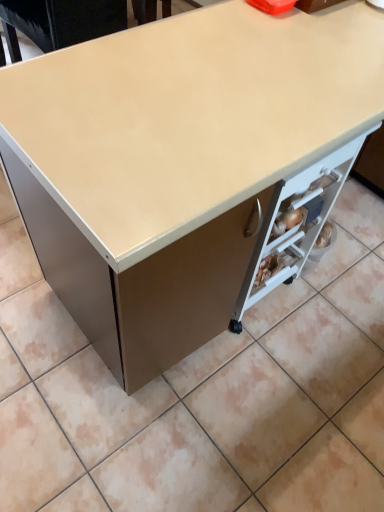
Where is `matte white drawer at lower right`? This screenshot has width=384, height=512. matte white drawer at lower right is located at coordinates (295, 224).

What do you see at coordinates (295, 224) in the screenshot? I see `matte white drawer at lower right` at bounding box center [295, 224].

Locate an element on the screen. The height and width of the screenshot is (512, 384). matte white drawer at lower right is located at coordinates (295, 224).